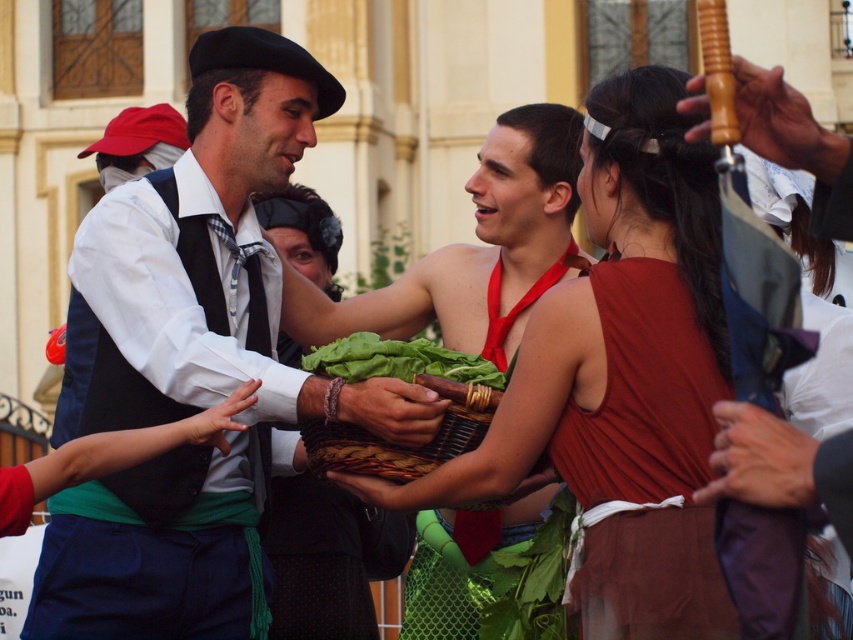
You are a photographer trying to capture a candid shot of the matte black vest at center and the woven brown basket at center. Since you want to ensure both are clearly visible in your photo, which object should you focus on first to ensure depth of field?

You should focus on the matte black vest at center first because it is in front of the woven brown basket at center, so focusing on the closer object will ensure both are in focus if the depth of field is sufficient.